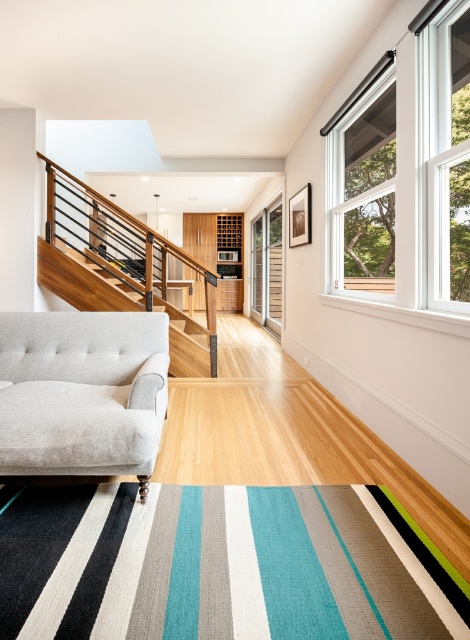
You are standing in the middle of the room and want to look out the white wood window at upper right. In which direction should you turn your head to see it?

The white wood window at upper right is located at point (404, 172), so you should turn your head to the right and upwards to see it.